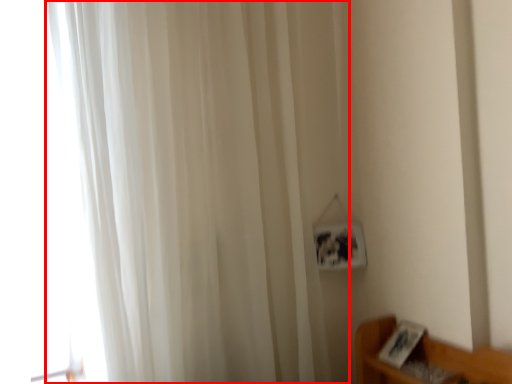
Question: From the image's perspective, considering the relative positions of curtain (annotated by the red box) and glass door in the image provided, where is curtain (annotated by the red box) located with respect to the staircase?

Choices:
 (A) above
 (B) below

Answer: (B)